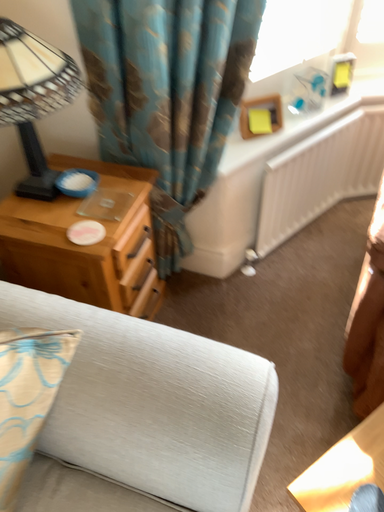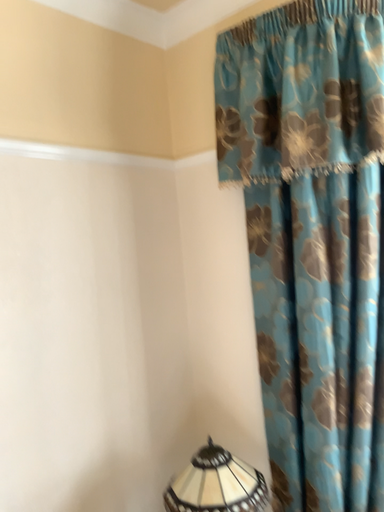
Question: How did the camera likely rotate when shooting the video?

Choices:
 (A) rotated right
 (B) rotated left

Answer: (B)